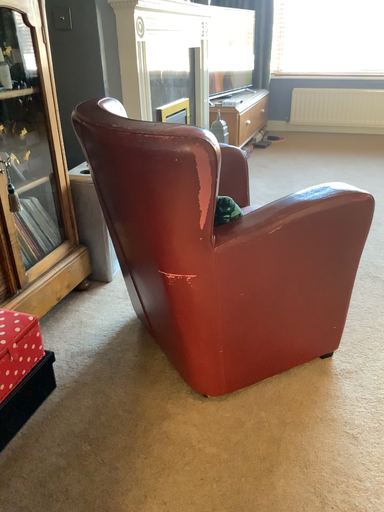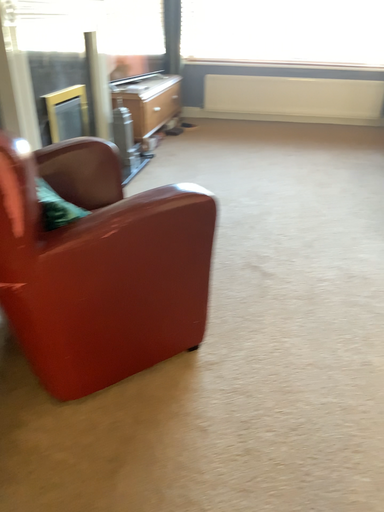
Question: Which way did the camera rotate in the video?

Choices:
 (A) rotated left
 (B) rotated right

Answer: (B)